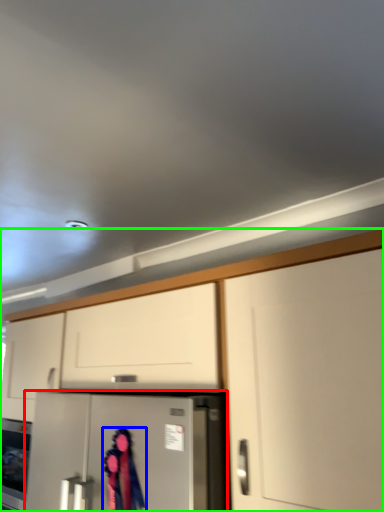
Question: Which object is the closest to the refrigerator (highlighted by a red box)? Choose among these: woman (highlighted by a blue box) or cabinetry (highlighted by a green box).

Choices:
 (A) woman
 (B) cabinetry

Answer: (A)